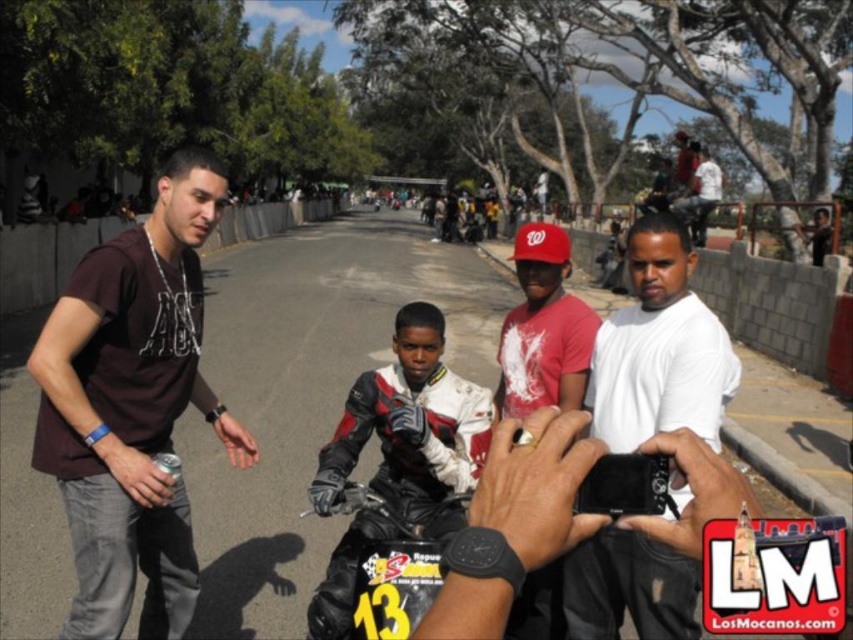
You are a photographer at the event and need to ensure both the white matte shirt at center and the leather jacket at center are visible in your photo. Which clothing item should you focus on first to ensure it doesn

The white matte shirt at center has a larger size compared to the leather jacket at center, so focusing on the white matte shirt at center first will ensure it is properly captured in the photo.